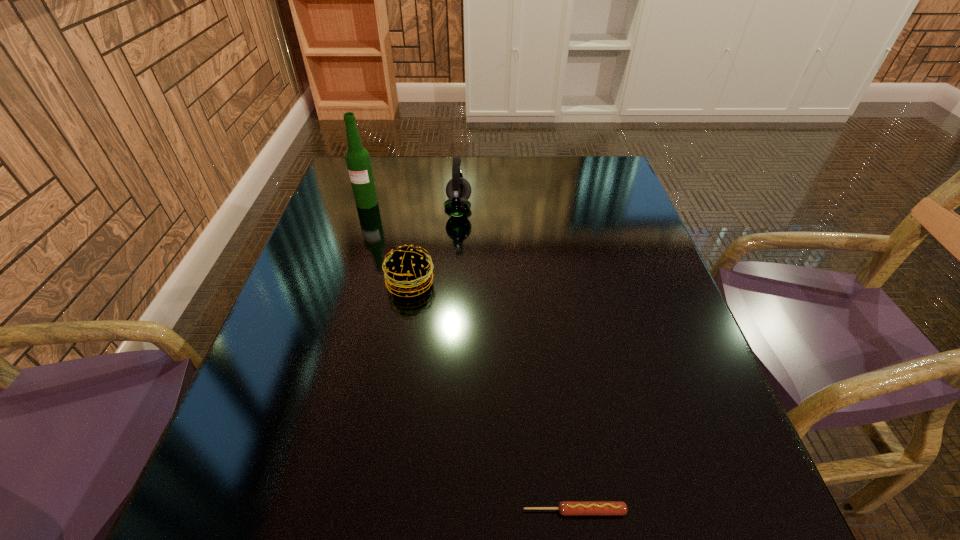
The height and width of the screenshot is (540, 960). What are the coordinates of `empty space that is in between the tallest object and the second nearest object` in the screenshot? It's located at (389, 243).

At what (x,y) coordinates should I click in order to perform the action: click on free space between the patty and the second tallest object. Please return your answer as a coordinate pair (x, y). The width and height of the screenshot is (960, 540). Looking at the image, I should click on (435, 246).

At what (x,y) coordinates should I click in order to perform the action: click on object that stands as the second closest to the rightmost object. Please return your answer as a coordinate pair (x, y). Looking at the image, I should click on point(458,190).

Where is `object that is the third nearest to the nearest object`? The width and height of the screenshot is (960, 540). object that is the third nearest to the nearest object is located at coordinates (357, 158).

The width and height of the screenshot is (960, 540). I want to click on vacant space that satisfies the following two spatial constraints: 1. on the label of the tallest object; 2. on the left side of the third tallest object, so click(341, 283).

The height and width of the screenshot is (540, 960). Find the location of `vacant space that satisfies the following two spatial constraints: 1. on the label of the leftmost object; 2. on the left side of the sausage`. vacant space that satisfies the following two spatial constraints: 1. on the label of the leftmost object; 2. on the left side of the sausage is located at coordinates (268, 511).

At what (x,y) coordinates should I click in order to perform the action: click on vacant space that satisfies the following two spatial constraints: 1. on the ear cups of the third object from left to right; 2. on the front side of the second shortest object. Please return your answer as a coordinate pair (x, y). This screenshot has width=960, height=540. Looking at the image, I should click on (454, 283).

Where is `vacant position in the image that satisfies the following two spatial constraints: 1. on the label of the patty; 2. on the left side of the leftmost object`? The height and width of the screenshot is (540, 960). vacant position in the image that satisfies the following two spatial constraints: 1. on the label of the patty; 2. on the left side of the leftmost object is located at coordinates (341, 283).

Identify the location of free space in the image that satisfies the following two spatial constraints: 1. on the label of the tallest object; 2. on the right side of the nearest object. (268, 511).

Identify the location of free region that satisfies the following two spatial constraints: 1. on the label of the leftmost object; 2. on the right side of the shortest object. (268, 511).